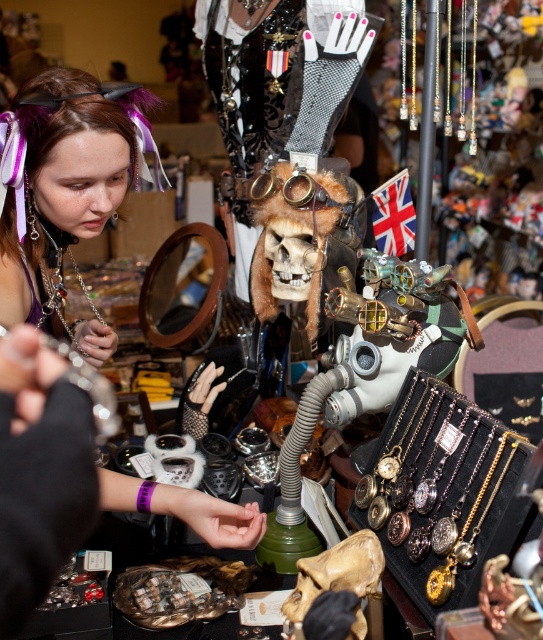
Between point (97, 138) and point (327, 225), which one is positioned behind?

The point (327, 225) is more distant.

Between point (66, 152) and point (302, 220), which one is positioned behind?

The point (302, 220) is behind.

What are the coordinates of `matte purple hair clip at upper left` in the screenshot? It's located at (64, 179).

Does shiny metallic skull at center have a smaller size compared to gold metallic goggles at center?

Actually, shiny metallic skull at center might be larger than gold metallic goggles at center.

What do you see at coordinates (266, 218) in the screenshot? The height and width of the screenshot is (640, 543). I see `shiny metallic skull at center` at bounding box center [266, 218].

Identify the location of shiny metallic skull at center. Image resolution: width=543 pixels, height=640 pixels. (266, 218).

Who is positioned more to the left, matte purple hair clip at upper left or gold metallic goggles at center?

From the viewer's perspective, matte purple hair clip at upper left appears more on the left side.

Is matte purple hair clip at upper left to the right of gold metallic goggles at center from the viewer's perspective?

In fact, matte purple hair clip at upper left is to the left of gold metallic goggles at center.

Image resolution: width=543 pixels, height=640 pixels. What do you see at coordinates (64, 179) in the screenshot?
I see `matte purple hair clip at upper left` at bounding box center [64, 179].

Identify the location of matte purple hair clip at upper left. This screenshot has height=640, width=543. (64, 179).